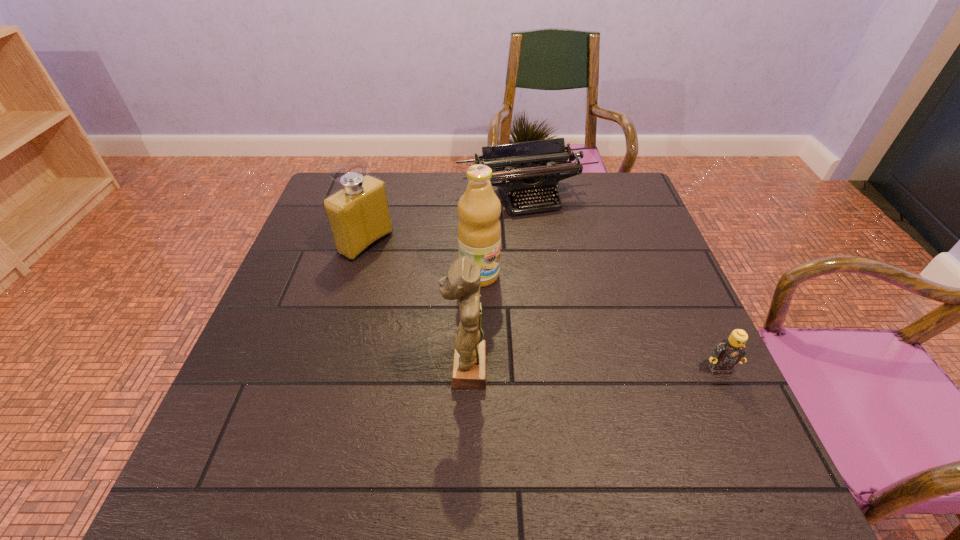
Image resolution: width=960 pixels, height=540 pixels. I want to click on vacant point located between the leftmost object and the olive oil, so click(x=422, y=259).

Where is `the second closest object to the leftmost object`? This screenshot has width=960, height=540. the second closest object to the leftmost object is located at coordinates (479, 230).

Image resolution: width=960 pixels, height=540 pixels. What are the coordinates of `the fourth closest object relative to the olive oil` in the screenshot? It's located at (729, 352).